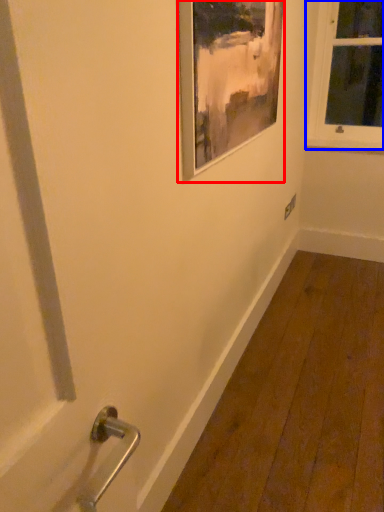
Question: Which object appears farthest to the camera in this image, picture frame (highlighted by a red box) or window (highlighted by a blue box)?

Choices:
 (A) picture frame
 (B) window

Answer: (B)